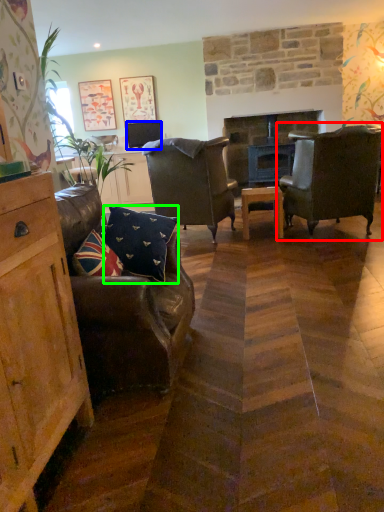
Question: Estimate the real-world distances between objects in this image. Which object is farther from chair (highlighted by a red box), television (highlighted by a blue box) or pillow (highlighted by a green box)?

Choices:
 (A) television
 (B) pillow

Answer: (A)